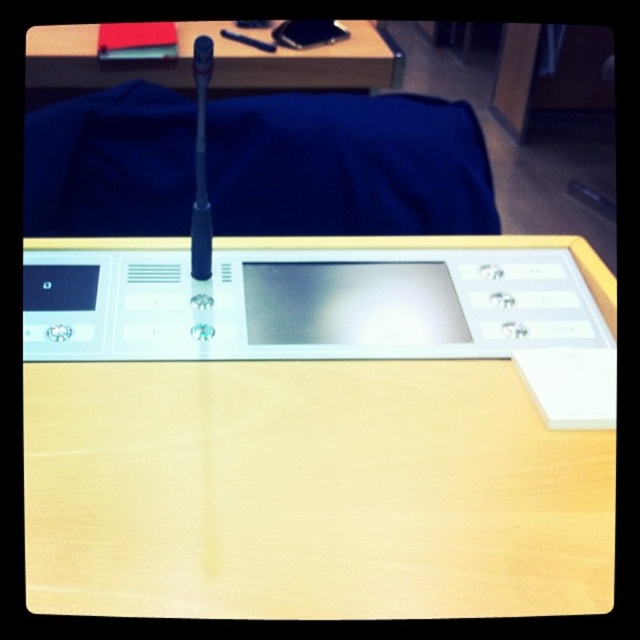
Question: Which of these objects is positioned closest to the wooden table at upper center?

Choices:
 (A) satin silver tablet at center
 (B) light wood table at center
 (C) blue fabric at center

Answer: (C)

Question: Which is farther from the wooden table at upper center?

Choices:
 (A) satin silver tablet at center
 (B) light wood table at center

Answer: (B)

Question: Where is satin silver tablet at center located in relation to wooden table at upper center in the image?

Choices:
 (A) right
 (B) left

Answer: (A)

Question: Can you confirm if light wood table at center is thinner than wooden table at upper center?

Choices:
 (A) no
 (B) yes

Answer: (B)

Question: Which object is the closest to the light wood table at center?

Choices:
 (A) blue fabric at center
 (B) wooden table at upper center
 (C) satin silver tablet at center

Answer: (C)

Question: Can you confirm if blue fabric at center is thinner than satin silver tablet at center?

Choices:
 (A) yes
 (B) no

Answer: (B)